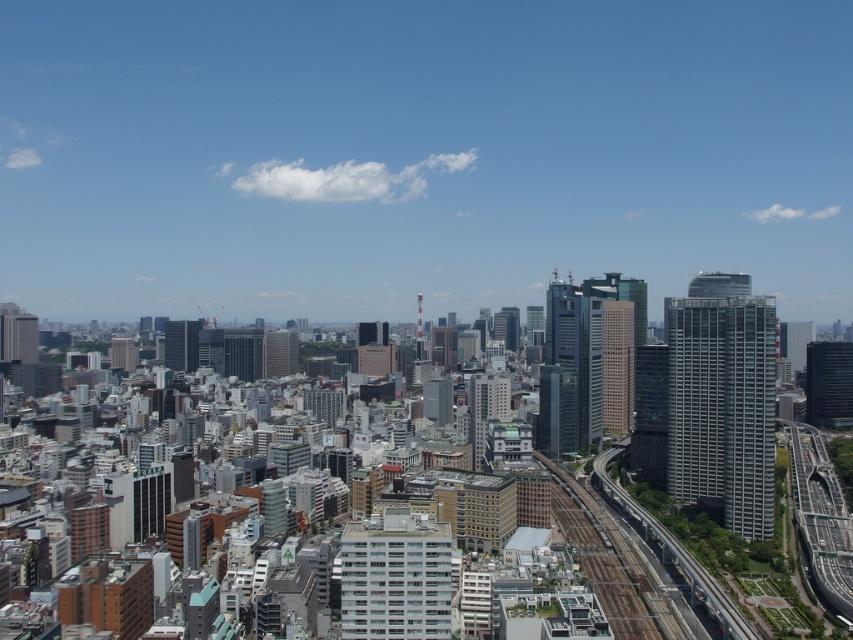
Where is `glassy silver skyscraper at right`? This screenshot has width=853, height=640. glassy silver skyscraper at right is located at coordinates (x=722, y=400).

Who is positioned more to the right, glassy silver skyscraper at right or metallic train tracks at lower right?

glassy silver skyscraper at right

Which is in front, point (722, 333) or point (627, 496)?

Point (722, 333)

You are a GUI agent. You are given a task and a screenshot of the screen. Output one action in this format:
    pyautogui.click(x=<x>, y=<y>)
    Task: Click on the glassy silver skyscraper at right
    Image resolution: width=853 pixels, height=640 pixels.
    Given the screenshot: What is the action you would take?
    pyautogui.click(x=722, y=400)

Describe the element at coordinates (608, 561) in the screenshot. The image size is (853, 640). I see `metallic silver train track at center-right` at that location.

Can you confirm if metallic silver train track at center-right is positioned to the left of matte glass skyscraper at center-left?

Incorrect, metallic silver train track at center-right is not on the left side of matte glass skyscraper at center-left.

Between point (596, 556) and point (186, 360), which one is positioned behind?

Positioned behind is point (186, 360).

Find the location of `metallic silver train track at center-right`. metallic silver train track at center-right is located at coordinates (608, 561).

Is white glass building at center thinner than metallic silver train track at center-right?

In fact, white glass building at center might be wider than metallic silver train track at center-right.

How distant is white glass building at center from metallic silver train track at center-right?

white glass building at center is 199.27 feet away from metallic silver train track at center-right.

Where is `white glass building at center`? The height and width of the screenshot is (640, 853). white glass building at center is located at coordinates (395, 577).

Where is `white glass building at center`? white glass building at center is located at coordinates (395, 577).